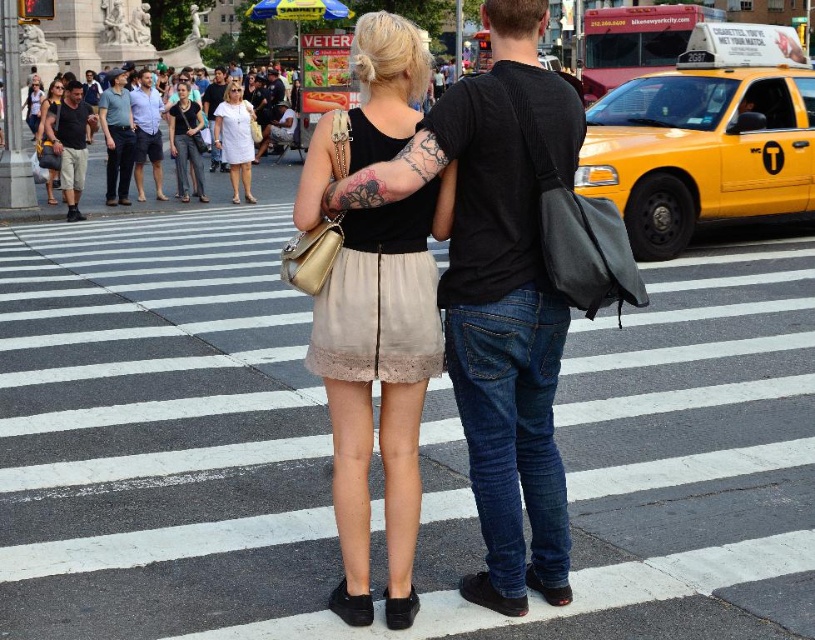
Measure the distance from white cotton dress at center to white matte dress at center.

white cotton dress at center is 3.22 meters away from white matte dress at center.

Find the location of a particular element. white cotton dress at center is located at coordinates (134, 189).

Which is above, black cotton t-shirt at center or white cotton dress at center?

white cotton dress at center is above.

Which is behind, point (501, 54) or point (172, 204)?

The point (172, 204) is more distant.

Between point (523, 464) and point (95, 147), which one is positioned in front?

Point (523, 464)

Locate an element on the screen. The width and height of the screenshot is (815, 640). black cotton t-shirt at center is located at coordinates click(x=498, y=298).

Is light blue denim shorts at center shorter than matte black tank top at upper left?

Correct, light blue denim shorts at center is not as tall as matte black tank top at upper left.

Can you confirm if light blue denim shorts at center is thinner than matte black tank top at upper left?

Yes, light blue denim shorts at center is thinner than matte black tank top at upper left.

Where is `light blue denim shorts at center`? This screenshot has height=640, width=815. light blue denim shorts at center is located at coordinates (146, 132).